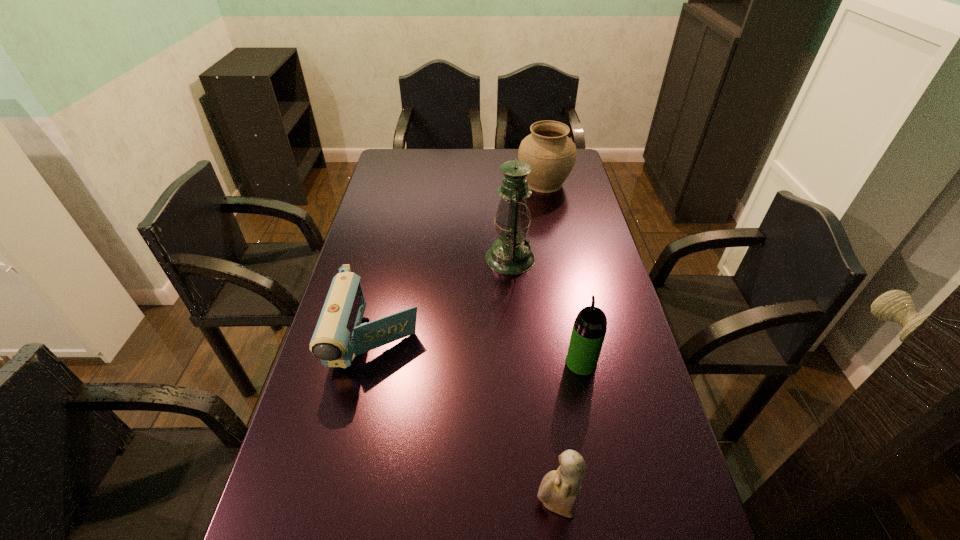
Find the location of a particular element. Image resolution: width=960 pixels, height=540 pixels. vacant space located on the front-facing side of the figurine is located at coordinates (409, 504).

Where is `vacant space located on the front-facing side of the figurine`? vacant space located on the front-facing side of the figurine is located at coordinates (460, 504).

Image resolution: width=960 pixels, height=540 pixels. What are the coordinates of `blank space located 0.260m from the spout of the thermos bottle` in the screenshot? It's located at (564, 282).

This screenshot has height=540, width=960. Identify the location of vacant space positioned 0.050m from the spout of the thermos bottle. (576, 335).

Where is `free space located 0.290m from the spout of the thermos bottle`? free space located 0.290m from the spout of the thermos bottle is located at coordinates point(564,275).

Find the location of a particular element. This screenshot has width=960, height=540. vacant region located on the side of the leftmost object with the flip-out screen is located at coordinates pos(352,449).

Where is `object that is at the far edge`? This screenshot has height=540, width=960. object that is at the far edge is located at coordinates (551, 154).

Identify the location of object that is at the left edge. (339, 336).

What are the coordinates of `urn located at the right edge` in the screenshot? It's located at (551, 154).

This screenshot has height=540, width=960. I want to click on thermos bottle that is at the right edge, so click(x=589, y=329).